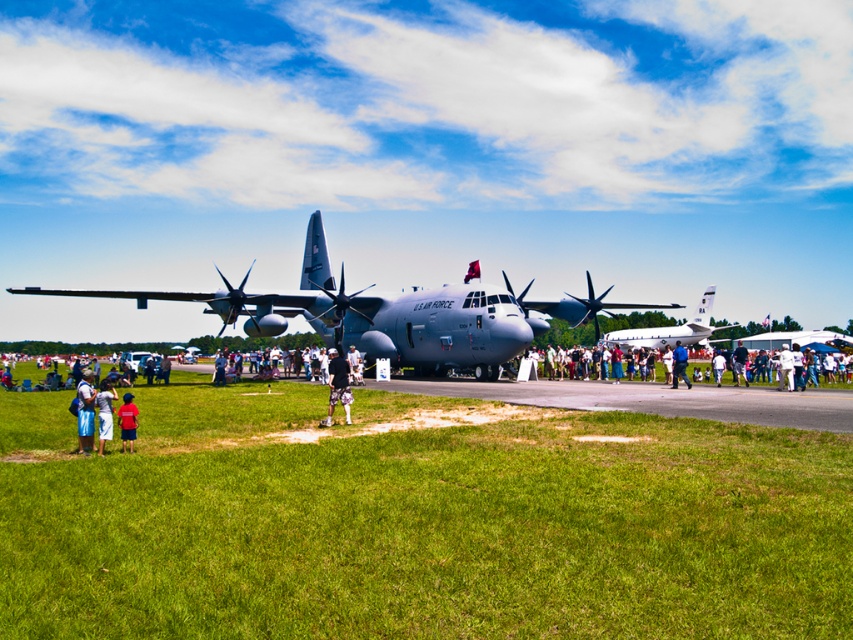
Question: Which of these objects is positioned closest to the white cotton crowd at center?

Choices:
 (A) camouflage shorts at center
 (B) denim shorts at center
 (C) blue fabric shirt at center
 (D) matte gray airplane at center

Answer: (C)

Question: Estimate the real-world distances between objects in this image. Which object is farther from the denim shorts at center?

Choices:
 (A) blue denim shorts at center
 (B) green grass at center

Answer: (B)

Question: Does matte gray airplane at center have a smaller size compared to red shirt at center?

Choices:
 (A) no
 (B) yes

Answer: (A)

Question: Can you confirm if matte gray airplane at center is positioned to the right of white cotton crowd at center?

Choices:
 (A) yes
 (B) no

Answer: (B)

Question: Does camouflage shorts at center have a lesser width compared to red shirt at center?

Choices:
 (A) no
 (B) yes

Answer: (A)

Question: Which point is closer to the camera?

Choices:
 (A) camouflage shorts at center
 (B) blue denim shorts at center

Answer: (B)